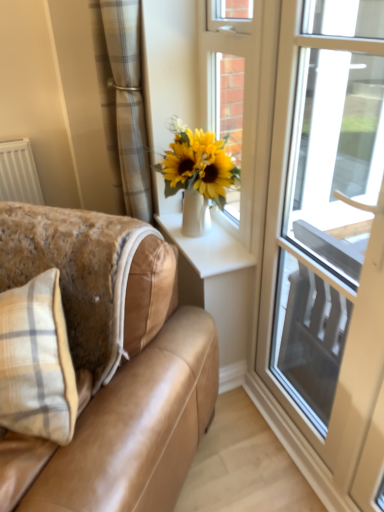
The width and height of the screenshot is (384, 512). I want to click on transparent glass door at right, so click(x=326, y=251).

Locate an element on the screen. transparent glass door at right is located at coordinates (326, 251).

From the picture: From the image's perspective, relative to white glossy door at upper center, is tan leather couch at lower left above or below?

Based on their image positions, tan leather couch at lower left is located beneath white glossy door at upper center.

Between tan leather couch at lower left and white glossy door at upper center, which one appears on the left side from the viewer's perspective?

tan leather couch at lower left.

Between tan leather couch at lower left and white glossy door at upper center, which one has larger size?

tan leather couch at lower left.

Is point (336, 234) positioned in front of point (145, 194)?

Yes, it is.

Which of these two, transparent glass door at right or plaid fabric curtain at upper left, stands taller?

transparent glass door at right.

Which is behind, transparent glass door at right or plaid fabric curtain at upper left?

plaid fabric curtain at upper left is further from the camera.

Measure the distance between transparent glass door at right and plaid fabric curtain at upper left.

transparent glass door at right is 4.97 feet away from plaid fabric curtain at upper left.

Is point (224, 130) behind point (242, 263)?

Yes, it is behind point (242, 263).

Between white glossy door at upper center and white glossy vase at upper center, which one has more height?

With more height is white glossy door at upper center.

The height and width of the screenshot is (512, 384). In the image, there is a white glossy door at upper center. Identify the location of window sill below it (from the image's perspective). (207, 247).

Are white glossy door at upper center and white glossy vase at upper center making contact?

white glossy door at upper center is not next to white glossy vase at upper center, and they're not touching.

Can we say transparent glass door at right lies outside white glossy vase at upper center?

Indeed, transparent glass door at right is completely outside white glossy vase at upper center.

Is the position of transparent glass door at right less distant than that of white glossy vase at upper center?

Yes, transparent glass door at right is in front of white glossy vase at upper center.

Which is more to the right, transparent glass door at right or white glossy vase at upper center?

From the viewer's perspective, transparent glass door at right appears more on the right side.

From the picture: How different are the orientations of transparent glass door at right and white glossy vase at upper center in degrees?

The angular difference between transparent glass door at right and white glossy vase at upper center is 0.868 degrees.

Is white glossy door at upper center bigger than plaid fabric curtain at upper left?

No, white glossy door at upper center is not bigger than plaid fabric curtain at upper left.

Is white glossy door at upper center aimed at plaid fabric curtain at upper left?

No.

From a real-world perspective, is white glossy door at upper center positioned above or below plaid fabric curtain at upper left?

Clearly, from a real-world perspective, white glossy door at upper center is below plaid fabric curtain at upper left.

Considering the relative sizes of white glossy vase at upper center and transparent glass door at right in the image provided, is white glossy vase at upper center thinner than transparent glass door at right?

No.

Locate an element on the screen. The width and height of the screenshot is (384, 512). window sill that appears above the transparent glass door at right (from the image's perspective) is located at coordinates (207, 247).

Which object is positioned more to the left, white glossy vase at upper center or transparent glass door at right?

white glossy vase at upper center.

Consider the image. Can you confirm if white glossy vase at upper center is taller than transparent glass door at right?

Incorrect, the height of white glossy vase at upper center is not larger of that of transparent glass door at right.

Is point (235, 248) farther from viewer compared to point (212, 55)?

No, it is in front of (212, 55).

Is white glossy door at upper center inside white glossy vase at upper center?

Definitely not — white glossy door at upper center is not inside white glossy vase at upper center.

Based on the photo, is white glossy vase at upper center behind white glossy door at upper center?

Yes, white glossy vase at upper center is further from the viewer.

You are a GUI agent. You are given a task and a screenshot of the screen. Output one action in this format:
    pyautogui.click(x=<x>, y=<y>)
    Task: Click on the door that is behind the tan leather couch at lower left
    
    Given the screenshot: What is the action you would take?
    pyautogui.click(x=232, y=93)

Where is `curtain lying above the transparent glass door at right (from the image's perspective)`? The height and width of the screenshot is (512, 384). curtain lying above the transparent glass door at right (from the image's perspective) is located at coordinates (123, 103).

Estimate the real-world distances between objects in this image. Which object is further from plaid fabric curtain at upper left, tan leather couch at lower left or transparent glass door at right?

Based on the image, transparent glass door at right appears to be further to plaid fabric curtain at upper left.

Looking at the image, which one is located closer to transparent glass door at right, white glossy vase at upper center or plaid fabric curtain at upper left?

Based on the image, plaid fabric curtain at upper left appears to be nearer to transparent glass door at right.

Consider the image. Which object lies further to the anchor point plaid fabric curtain at upper left, white glossy door at upper center or tan leather couch at lower left?

tan leather couch at lower left is further to plaid fabric curtain at upper left.

When comparing their distances from plaid fabric curtain at upper left, does transparent glass door at right or white glossy vase at upper center seem closer?

The object closer to plaid fabric curtain at upper left is white glossy vase at upper center.

Considering their positions, is white glossy door at upper center positioned further to white glossy vase at upper center than tan leather couch at lower left?

tan leather couch at lower left is positioned further to the anchor white glossy vase at upper center.

From the image, which object appears to be nearer to white glossy door at upper center, plaid fabric curtain at upper left or tan leather couch at lower left?

plaid fabric curtain at upper left.

From the image, which object appears to be nearer to transparent glass door at right, tan leather couch at lower left or white glossy door at upper center?

white glossy door at upper center.

From the image, which object appears to be nearer to plaid fabric curtain at upper left, white glossy vase at upper center or tan leather couch at lower left?

Based on the image, white glossy vase at upper center appears to be nearer to plaid fabric curtain at upper left.

This screenshot has width=384, height=512. In order to click on door between tan leather couch at lower left and transparent glass door at right in this screenshot , I will do `click(232, 93)`.

Where is `studio couch between transparent glass door at right and white glossy vase at upper center from front to back`? The height and width of the screenshot is (512, 384). studio couch between transparent glass door at right and white glossy vase at upper center from front to back is located at coordinates (112, 364).

This screenshot has height=512, width=384. What are the coordinates of `door between plaid fabric curtain at upper left and tan leather couch at lower left in the up-down direction` in the screenshot? It's located at (232, 93).

Identify the location of door between transparent glass door at right and white glossy vase at upper center in the front-back direction. Image resolution: width=384 pixels, height=512 pixels. (232, 93).